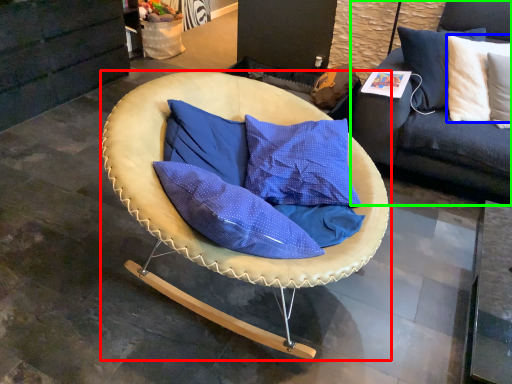
Question: Based on their relative distances, which object is farther from chair (highlighted by a red box)? Choose from pillow (highlighted by a blue box) and studio couch (highlighted by a green box).

Choices:
 (A) pillow
 (B) studio couch

Answer: (A)